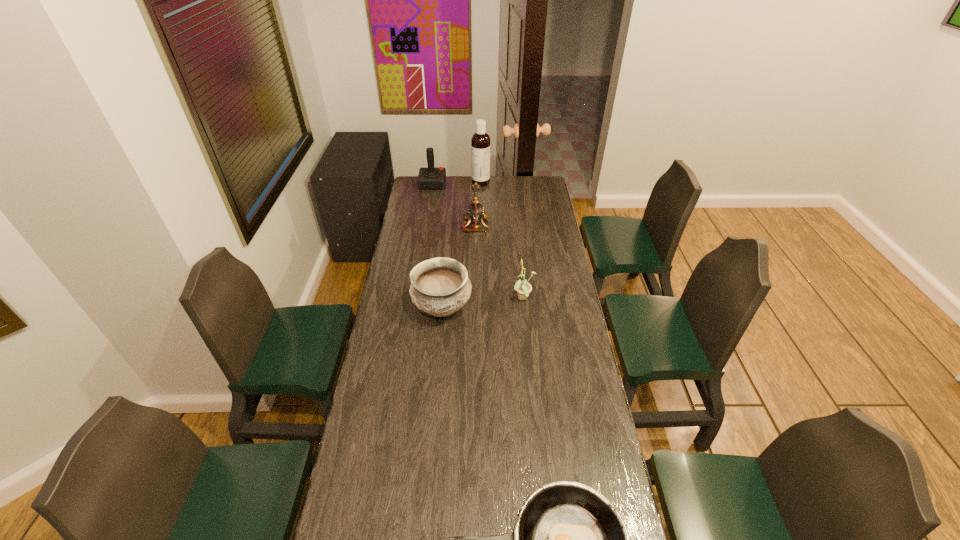
You are a GUI agent. You are given a task and a screenshot of the screen. Output one action in this format:
    pyautogui.click(x=<x>, y=<y>)
    Task: Click on the free point located 0.390m on the front-facing side of the sunflower
    
    Given the screenshot: What is the action you would take?
    pyautogui.click(x=423, y=299)

Identify the location of free region located 0.200m on the front-facing side of the sunflower. This screenshot has height=540, width=960. (467, 299).

You are a GUI agent. You are given a task and a screenshot of the screen. Output one action in this format:
    pyautogui.click(x=<x>, y=<y>)
    Task: Click on the vacant area situated on the front-facing side of the sunflower
    
    Given the screenshot: What is the action you would take?
    pyautogui.click(x=494, y=299)

I want to click on vacant space located 0.250m on the right of the pottery, so click(x=531, y=309).

In order to click on dishwasher detergent that is at the far edge in this screenshot , I will do `click(480, 142)`.

Where is `joystick located in the far edge section of the desktop`? This screenshot has height=540, width=960. joystick located in the far edge section of the desktop is located at coordinates (429, 178).

The height and width of the screenshot is (540, 960). In order to click on joystick positioned at the left edge in this screenshot , I will do `click(429, 178)`.

The image size is (960, 540). In order to click on pottery present at the left edge in this screenshot , I will do `click(440, 286)`.

I want to click on object present at the far left corner, so click(x=429, y=178).

Image resolution: width=960 pixels, height=540 pixels. In the image, there is a desktop. Identify the location of free space at the far edge. [x=461, y=179].